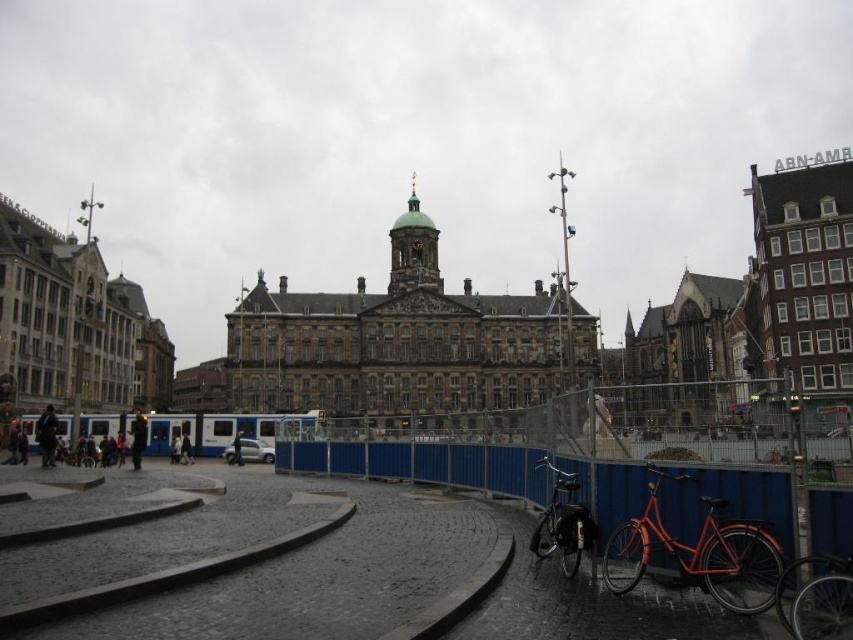
Question: Which point is closer to the camera?

Choices:
 (A) shiny black bicycle at lower right
 (B) orange matte bicycle at lower right
 (C) shiny red bicycle at lower right
 (D) blue plastic fence at lower right

Answer: (B)

Question: Does orange matte bicycle at lower right have a lesser width compared to shiny black bicycle at lower right?

Choices:
 (A) no
 (B) yes

Answer: (B)

Question: Which point is closer to the camera taking this photo?

Choices:
 (A) (759, 532)
 (B) (610, 528)
 (C) (399, 228)
 (D) (567, 577)

Answer: (A)

Question: Is orange matte bicycle at lower right smaller than shiny black bicycle at lower right?

Choices:
 (A) no
 (B) yes

Answer: (B)

Question: Can you confirm if shiny red bicycle at lower right is positioned above shiny black bicycle at lower right?

Choices:
 (A) no
 (B) yes

Answer: (A)

Question: Which point appears closest to the camera in this image?

Choices:
 (A) click(828, 570)
 (B) click(540, 538)
 (C) click(657, 499)
 (D) click(843, 515)

Answer: (A)